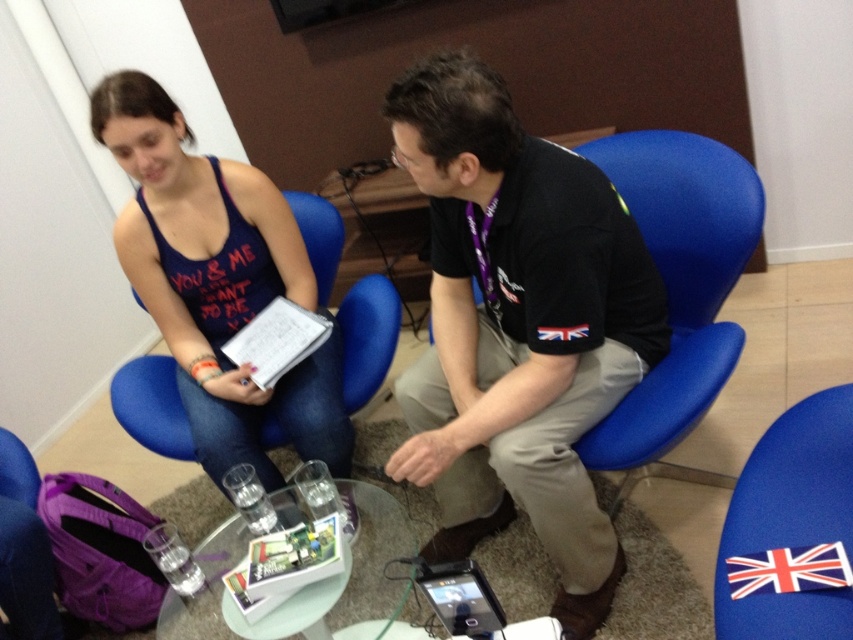
You are a delivery person who needs to place a small package on the transparent glass table at center without touching the black cotton shirt at center. Is there enough space between them to do this?

The black cotton shirt at center and transparent glass table at center are 43.50 centimeters apart. Since the package is small, there is sufficient space to place it on the transparent glass table at center without touching the black cotton shirt at center.

Based on the scene described, which clothing item is taller in height between the black cotton shirt at center and the matte black tank top at upper left?

The black cotton shirt at center is much taller than the matte black tank top at upper left.

You are a guest at a party and want to place a small gift on the transparent glass table at center without blocking the white paper clipboard at center. Is this possible?

The transparent glass table at center is positioned under the white paper clipboard at center, so placing the gift on the table would not block the clipboard since it is beneath it.